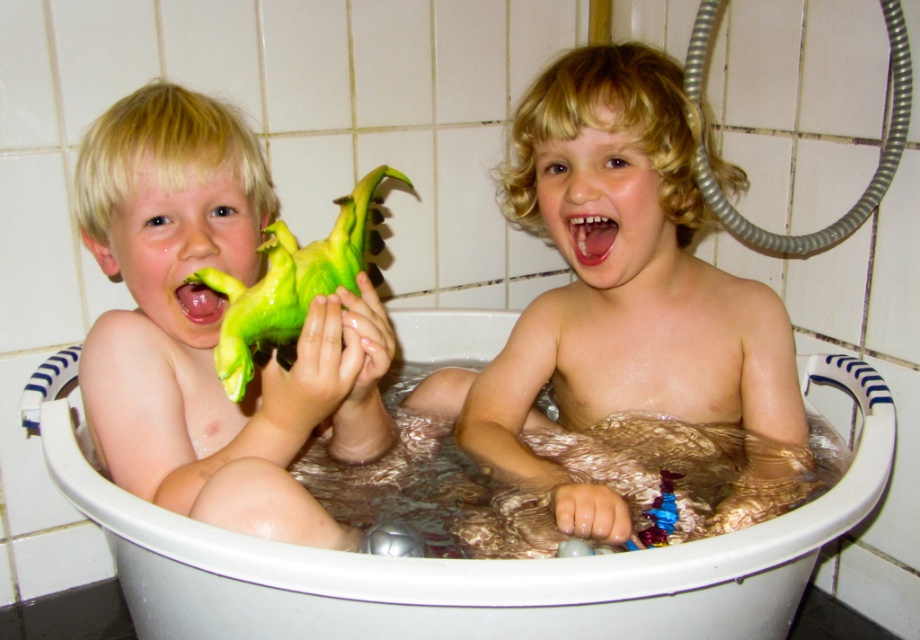
Question: Which point is farther from the camera taking this photo?

Choices:
 (A) (592, 531)
 (B) (593, 262)
 (C) (262, 301)

Answer: (B)

Question: Can you confirm if green rubber dinosaur at left is wider than bright white teeth at center?

Choices:
 (A) no
 (B) yes

Answer: (B)

Question: Does bright white teeth at center have a lesser width compared to green rubber toy at left?

Choices:
 (A) no
 (B) yes

Answer: (B)

Question: Considering the relative positions of white plastic bath at center and bright white teeth at center in the image provided, where is white plastic bath at center located with respect to bright white teeth at center?

Choices:
 (A) above
 (B) below

Answer: (B)

Question: Which point appears farthest from the camera in this image?

Choices:
 (A) (589, 120)
 (B) (123, 515)
 (C) (107, 454)

Answer: (A)

Question: Which of these objects is positioned closest to the white plastic bath at center?

Choices:
 (A) green rubber dinosaur at left
 (B) smooth plastic toy at center

Answer: (A)